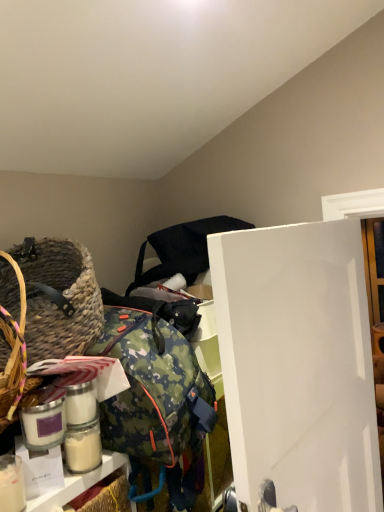
Question: Could woven straw picnic basket at left be considered to be inside white matte glass jar at lower left?

Choices:
 (A) no
 (B) yes

Answer: (A)

Question: Considering the relative sizes of white matte glass jar at lower left and woven straw picnic basket at left in the image provided, is white matte glass jar at lower left shorter than woven straw picnic basket at left?

Choices:
 (A) no
 (B) yes

Answer: (B)

Question: Can you confirm if white matte glass jar at lower left is taller than woven straw picnic basket at left?

Choices:
 (A) no
 (B) yes

Answer: (A)

Question: Is white matte glass jar at lower left at the right side of woven straw picnic basket at left?

Choices:
 (A) no
 (B) yes

Answer: (B)

Question: From a real-world perspective, is white matte glass jar at lower left positioned under woven straw picnic basket at left based on gravity?

Choices:
 (A) yes
 (B) no

Answer: (A)

Question: Is white matte glass jar at lower left to the left of woven straw picnic basket at left from the viewer's perspective?

Choices:
 (A) yes
 (B) no

Answer: (B)

Question: Are black fabric bag at upper center and woven straw picnic basket at left far apart?

Choices:
 (A) yes
 (B) no

Answer: (B)

Question: Is black fabric bag at upper center located outside woven straw picnic basket at left?

Choices:
 (A) no
 (B) yes

Answer: (B)

Question: Considering the relative sizes of black fabric bag at upper center and woven straw picnic basket at left in the image provided, is black fabric bag at upper center smaller than woven straw picnic basket at left?

Choices:
 (A) yes
 (B) no

Answer: (B)

Question: From a real-world perspective, is black fabric bag at upper center on woven straw picnic basket at left?

Choices:
 (A) yes
 (B) no

Answer: (A)

Question: Is black fabric bag at upper center next to woven straw picnic basket at left?

Choices:
 (A) yes
 (B) no

Answer: (B)

Question: Does black fabric bag at upper center have a lesser width compared to woven straw picnic basket at left?

Choices:
 (A) yes
 (B) no

Answer: (B)

Question: Can you confirm if black fabric bag at upper center is smaller than white matte glass jar at lower left?

Choices:
 (A) yes
 (B) no

Answer: (B)